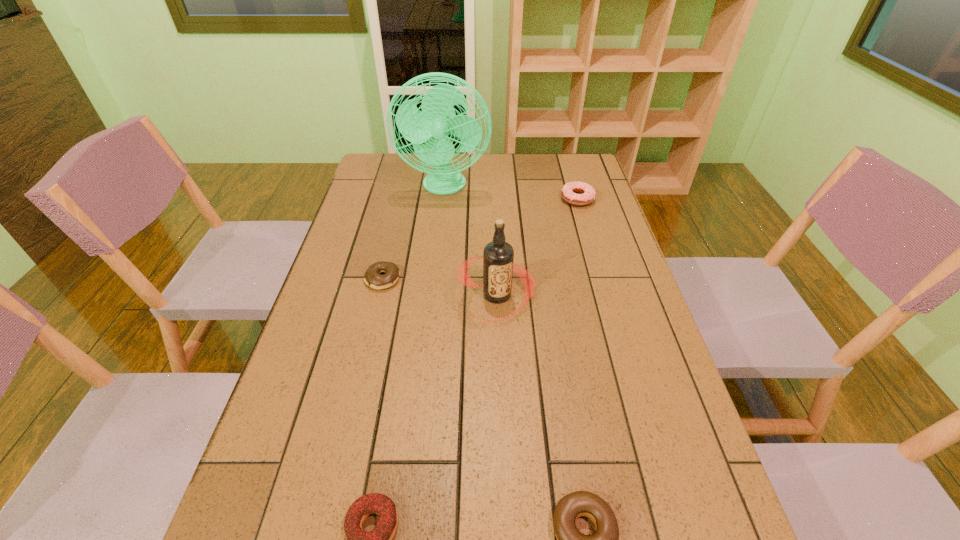
This screenshot has width=960, height=540. In order to click on vacant space in between the fan and the fifth shortest object in this screenshot , I will do `click(471, 241)`.

Find the location of `empty location between the farthest doughnut and the fifth shortest object`. empty location between the farthest doughnut and the fifth shortest object is located at coordinates (538, 247).

This screenshot has height=540, width=960. Find the location of `vacant area that lies between the second farthest doughnut and the second tallest object`. vacant area that lies between the second farthest doughnut and the second tallest object is located at coordinates (x=440, y=287).

You are a GUI agent. You are given a task and a screenshot of the screen. Output one action in this format:
    pyautogui.click(x=<x>, y=<y>)
    Task: Click on the free space between the rightmost object and the fan
    Image resolution: width=960 pixels, height=540 pixels.
    Given the screenshot: What is the action you would take?
    pyautogui.click(x=511, y=193)

At what (x,y) coordinates should I click in order to perform the action: click on vacant space in between the root beer and the third nearest doughnut. Please return your answer as a coordinate pair (x, y). The image size is (960, 540). Looking at the image, I should click on (440, 287).

Locate which object is the fifth closest to the fan. Please provide its 2D coordinates. Your answer should be formatted as a tuple, i.e. [(x, y)], where the tuple contains the x and y coordinates of a point satisfying the conditions above.

[(605, 539)]

The height and width of the screenshot is (540, 960). What are the coordinates of `object that is the fifth closest to the second tallest object` in the screenshot? It's located at (380, 538).

The height and width of the screenshot is (540, 960). What are the coordinates of `doughnut object that ranks as the closest to the third nearest doughnut` in the screenshot? It's located at (380, 538).

Identify which doughnut is the nearest to the farthest doughnut. Please provide its 2D coordinates. Your answer should be formatted as a tuple, i.e. [(x, y)], where the tuple contains the x and y coordinates of a point satisfying the conditions above.

[(372, 278)]

Identify the location of free location that satisfies the following two spatial constraints: 1. in front of the rightmost doughnut to blow air; 2. on the right side of the fan. (444, 199).